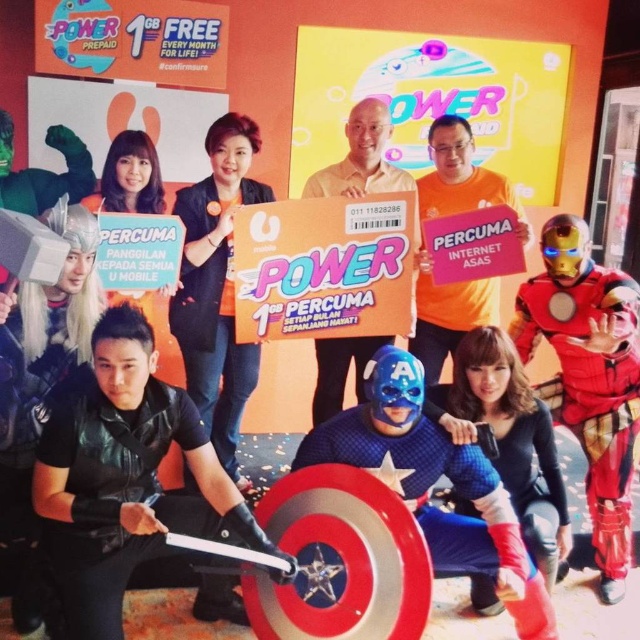
Question: Does shiny metallic iron man at right have a larger size compared to blue spandex suit at center?

Choices:
 (A) yes
 (B) no

Answer: (A)

Question: Which point is closer to the camera?

Choices:
 (A) (244, 125)
 (B) (406, 404)
 (C) (243, 620)
 (D) (378, 140)

Answer: (B)

Question: Does blue spandex suit at center appear over matte cardboard box at center?

Choices:
 (A) no
 (B) yes

Answer: (A)

Question: Which of the following is the farthest from the observer?

Choices:
 (A) blue spandex suit at center
 (B) matte cardboard box at center
 (C) orange matte shirt at center

Answer: (C)

Question: Estimate the real-world distances between objects in this image. Which object is closer to the matte cardboard box at center?

Choices:
 (A) shiny metallic iron man at right
 (B) blue spandex suit at center
 (C) orange fabric shirt at center
 (D) orange matte shirt at center

Answer: (D)

Question: Can you confirm if blue spandex suit at center is bigger than matte cardboard box at center?

Choices:
 (A) no
 (B) yes

Answer: (B)